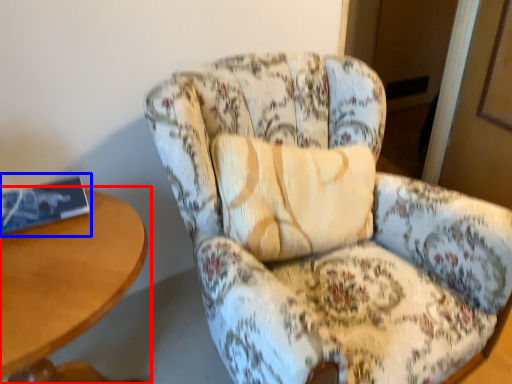
Question: Among these objects, which one is farthest to the camera, table (highlighted by a red box) or book (highlighted by a blue box)?

Choices:
 (A) table
 (B) book

Answer: (B)